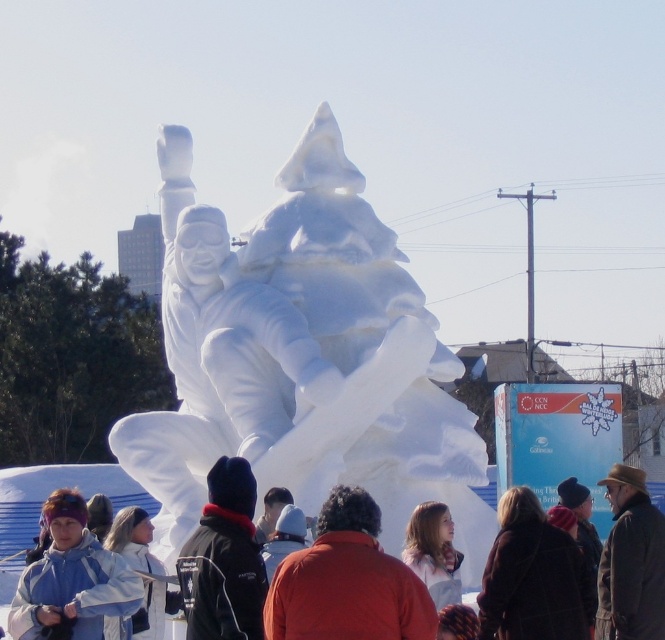
In the scene shown: Does matte white snow sculpture at center have a smaller size compared to white snow sculpture at lower left?

No, matte white snow sculpture at center is not smaller than white snow sculpture at lower left.

Between matte white snow sculpture at center and white snow sculpture at lower left, which one appears on the left side from the viewer's perspective?

Positioned to the left is white snow sculpture at lower left.

The height and width of the screenshot is (640, 665). Identify the location of matte white snow sculpture at center. (53, 488).

The height and width of the screenshot is (640, 665). I want to click on matte white snow sculpture at center, so click(x=53, y=488).

Is orange cotton sweater at center shorter than light brown hair at center?

No.

Between orange cotton sweater at center and light brown hair at center, which one is positioned lower?

orange cotton sweater at center is below.

Image resolution: width=665 pixels, height=640 pixels. Identify the location of orange cotton sweater at center. (346, 580).

Find the location of `orange cotton sweater at center`. orange cotton sweater at center is located at coordinates pos(346,580).

Find the location of a particular element. brown leather hat at lower right is located at coordinates (630, 561).

In the scene shown: How far apart are brown leather hat at lower right and light brown hair at center?

The distance of brown leather hat at lower right from light brown hair at center is 8.96 meters.

Does point (624, 502) lie behind point (434, 586)?

That is True.

Where is `brown leather hat at lower right`? The image size is (665, 640). brown leather hat at lower right is located at coordinates (630, 561).